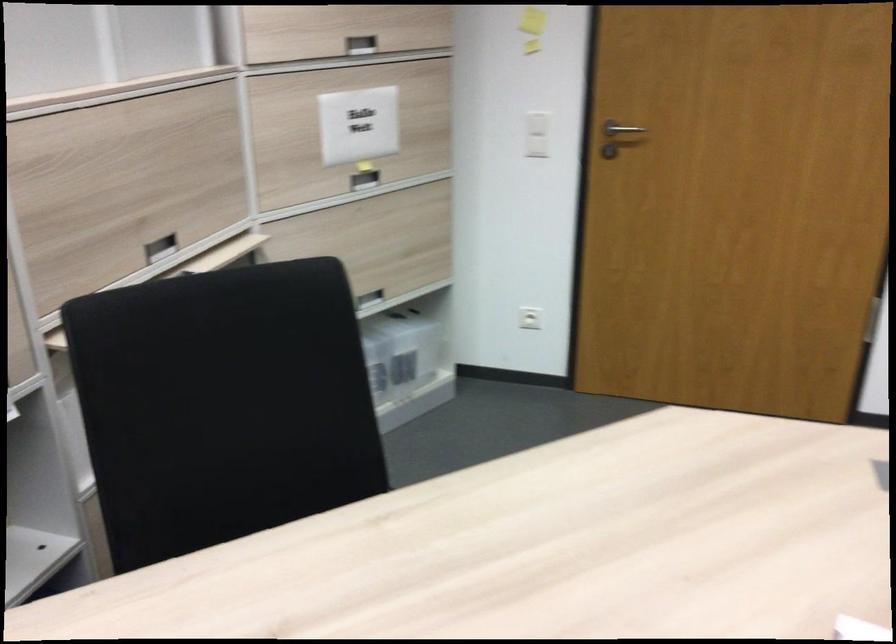
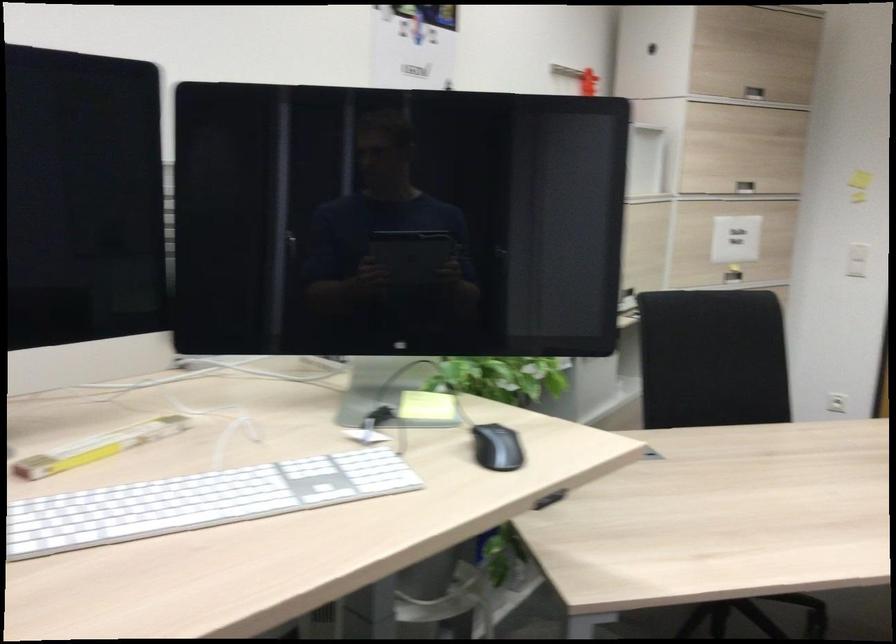
In the second image, find the point that corresponds to pixel 218 400 in the first image.

(712, 359)